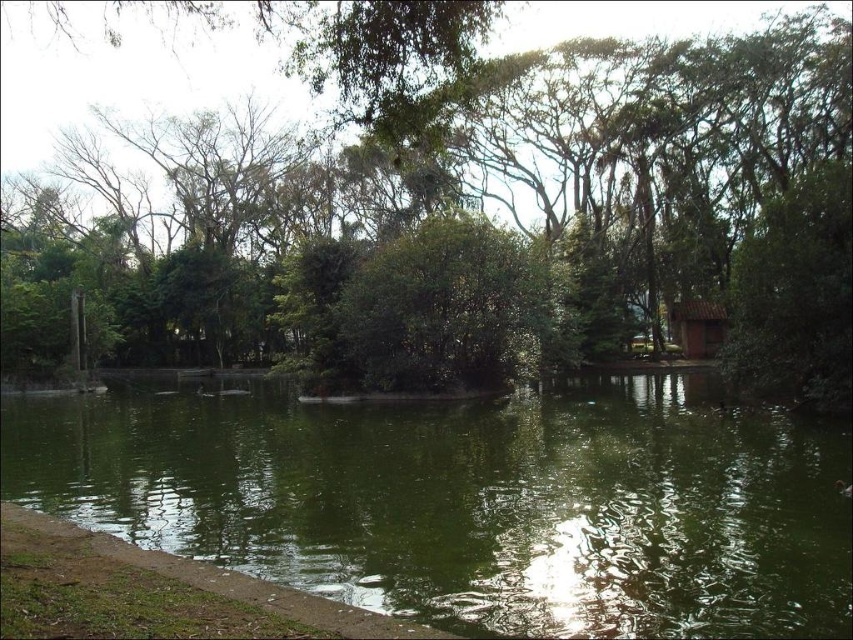
Question: Can you confirm if green leafy tree at center is positioned to the right of green liquid water at center?

Choices:
 (A) yes
 (B) no

Answer: (B)

Question: Which of the following is the closest to the observer?

Choices:
 (A) green liquid water at center
 (B) green leafy tree at center

Answer: (A)

Question: Which of the following is the closest to the observer?

Choices:
 (A) (132, 216)
 (B) (410, 512)

Answer: (B)

Question: Does green leafy tree at center appear over green liquid water at center?

Choices:
 (A) yes
 (B) no

Answer: (A)

Question: Is green leafy tree at center further to the viewer compared to green liquid water at center?

Choices:
 (A) yes
 (B) no

Answer: (A)